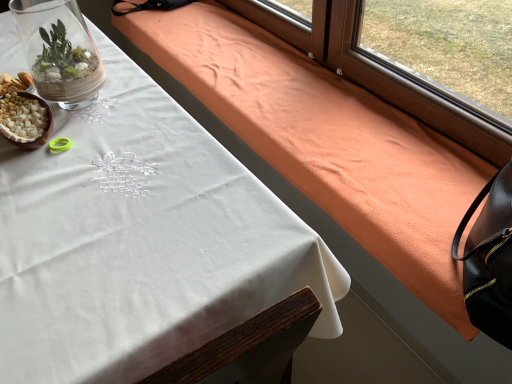
Where is `free location above orange suede blanket at upper right (from a real-world perspective)`? This screenshot has height=384, width=512. free location above orange suede blanket at upper right (from a real-world perspective) is located at coordinates (263, 77).